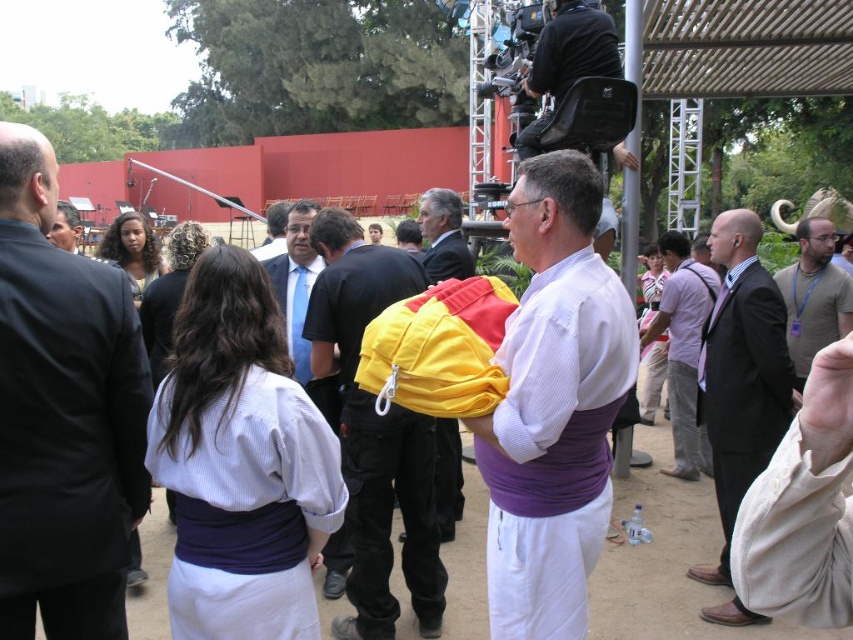
Between point (679, 362) and point (271, 212), which one is positioned behind?

The point (679, 362) is more distant.

Is light purple shirt at center taller than blue suit at center?

Correct, light purple shirt at center is much taller as blue suit at center.

The image size is (853, 640). What do you see at coordinates (683, 348) in the screenshot? I see `light purple shirt at center` at bounding box center [683, 348].

At what (x,y) coordinates should I click in order to perform the action: click on light purple shirt at center. Please return your answer as a coordinate pair (x, y). This screenshot has width=853, height=640. Looking at the image, I should click on (683, 348).

Does point (743, 221) come closer to viewer compared to point (286, 202)?

Yes, it is.

Is point (751, 305) positioned in front of point (276, 240)?

Yes, point (751, 305) is in front of point (276, 240).

Locate an element on the screen. The width and height of the screenshot is (853, 640). dark suit at right is located at coordinates (741, 372).

Who is higher up, yellow fabric backpack at center or black leather chair at upper center?

black leather chair at upper center is higher up.

This screenshot has height=640, width=853. Describe the element at coordinates (374, 433) in the screenshot. I see `yellow fabric backpack at center` at that location.

Which is in front, point (373, 568) or point (546, 54)?

Point (373, 568) is in front.

Locate an element on the screen. The width and height of the screenshot is (853, 640). yellow fabric backpack at center is located at coordinates (374, 433).